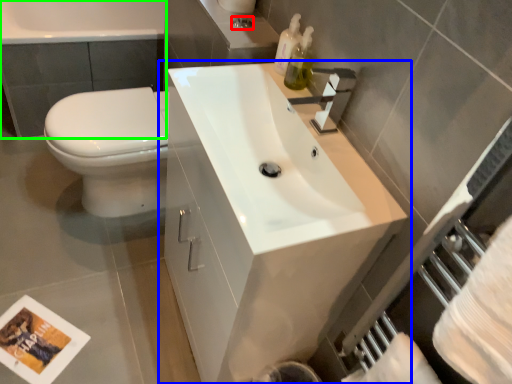
Question: Based on their relative distances, which object is farther from plumbing fixture (highlighted by a red box)? Choose from bathroom cabinet (highlighted by a blue box) and bath (highlighted by a green box).

Choices:
 (A) bathroom cabinet
 (B) bath

Answer: (B)